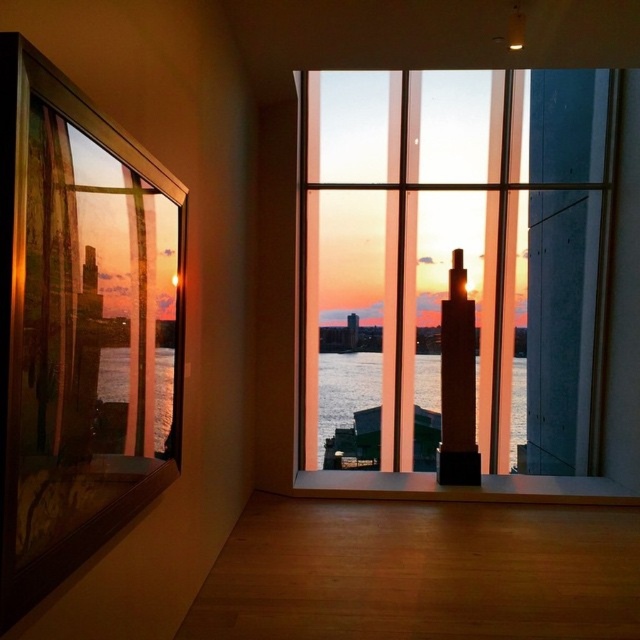
Question: Estimate the real-world distances between objects in this image. Which object is closer to the transparent glass window at center?

Choices:
 (A) translucent glass water at center
 (B) transparent glass window at left

Answer: (A)

Question: Is transparent glass window at center above transparent glass water at left?

Choices:
 (A) no
 (B) yes

Answer: (B)

Question: Which point is farther from the camera taking this photo?

Choices:
 (A) (108, 396)
 (B) (168, 444)

Answer: (B)

Question: Can you confirm if transparent glass window at center is smaller than transparent glass water at left?

Choices:
 (A) no
 (B) yes

Answer: (A)

Question: Which of the following is the farthest from the observer?

Choices:
 (A) transparent glass window at center
 (B) transparent glass water at left
 (C) translucent glass water at center
 (D) transparent glass window at left

Answer: (C)

Question: Can you confirm if transparent glass window at left is positioned to the left of translucent glass water at center?

Choices:
 (A) yes
 (B) no

Answer: (A)